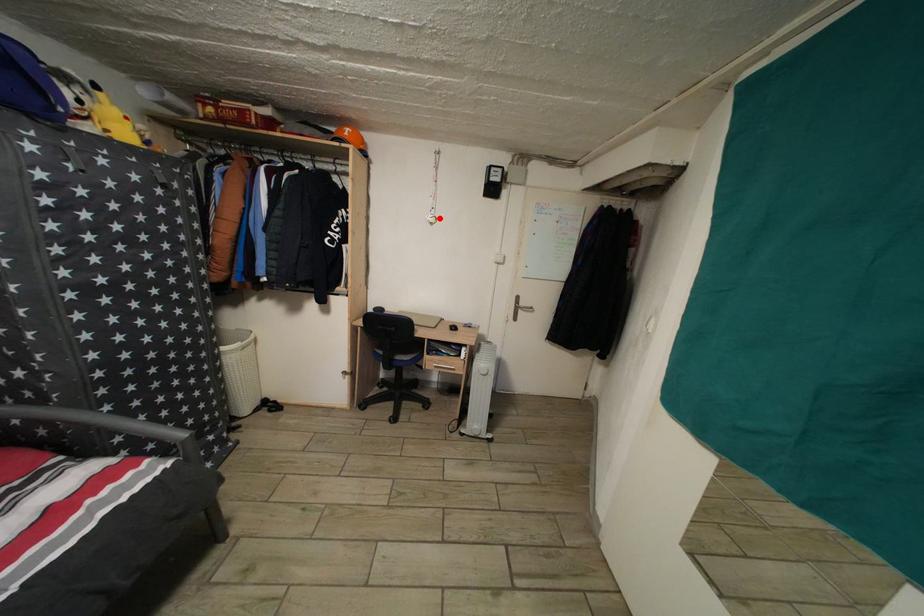
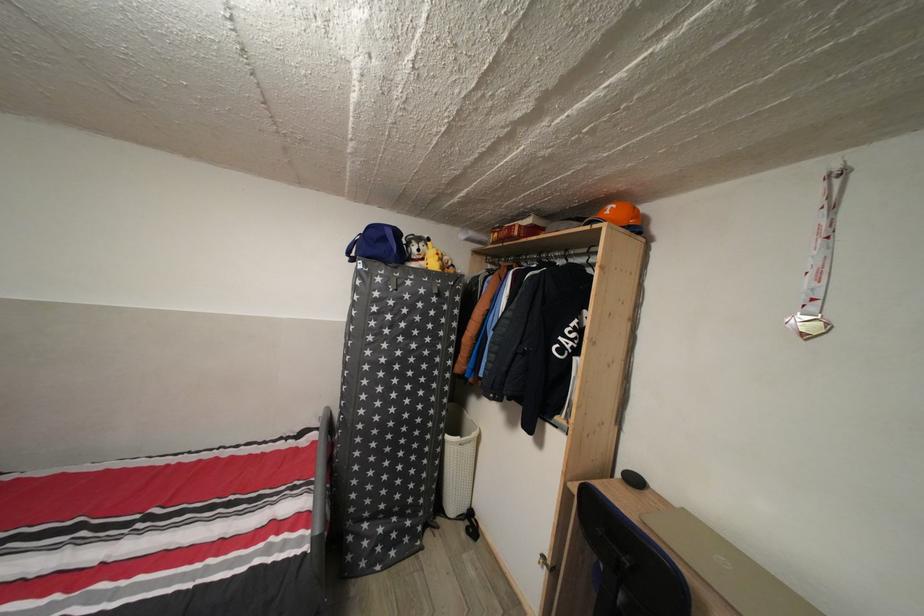
Locate, in the second image, the point that corresponds to the highlighted location in the first image.

(820, 314)